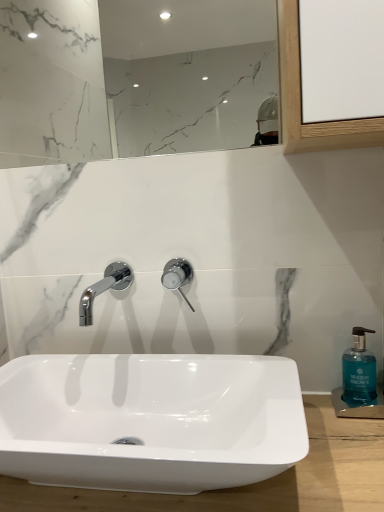
Locate an element on the screen. This screenshot has width=384, height=512. polished chrome tap at center is located at coordinates pos(178,276).

Describe the element at coordinates (255, 483) in the screenshot. I see `white glossy sink at center` at that location.

You are a GUI agent. You are given a task and a screenshot of the screen. Output one action in this format:
    pyautogui.click(x=<x>, y=<y>)
    Task: Click on the white glossy sink at center
    
    Given the screenshot: What is the action you would take?
    pyautogui.click(x=255, y=483)

Locate an element on the screen. The width and height of the screenshot is (384, 512). white marble mirror at upper center is located at coordinates (134, 78).

Which is correct: white marble mirror at upper center is inside polished chrome tap at center, or outside of it?

white marble mirror at upper center is located beyond the bounds of polished chrome tap at center.

Considering the sizes of objects white marble mirror at upper center and polished chrome tap at center in the image provided, who is smaller, white marble mirror at upper center or polished chrome tap at center?

Smaller between the two is polished chrome tap at center.

Is white marble mirror at upper center positioned behind polished chrome tap at center?

No, white marble mirror at upper center is closer to the camera.

Is white glossy sink at center facing away from polished chrome tap at center?

No, white glossy sink at center's orientation is not away from polished chrome tap at center.

Does white glossy sink at center have a lesser width compared to polished chrome tap at center?

Incorrect, the width of white glossy sink at center is not less than that of polished chrome tap at center.

From a real-world perspective, is white glossy sink at center positioned above or below polished chrome tap at center?

In terms of real-world spatial position, white glossy sink at center is below polished chrome tap at center.

Is polished chrome tap at center located within white glossy sink at center?

No, polished chrome tap at center is not a part of white glossy sink at center.

Does white glossy sink at center lie behind teal glass soap dispenser at right?

That is False.

From the picture: Considering the relative positions of white glossy sink at center and teal glass soap dispenser at right in the image provided, is white glossy sink at center to the left of teal glass soap dispenser at right from the viewer's perspective?

Yes.

Between white glossy sink at center and teal glass soap dispenser at right, which one has smaller size?

teal glass soap dispenser at right is smaller.

Is white glossy sink at center not within teal glass soap dispenser at right?

Yes, white glossy sink at center is located beyond the bounds of teal glass soap dispenser at right.

Does white marble mirror at upper center turn towards teal glass soap dispenser at right?

No, white marble mirror at upper center is not oriented towards teal glass soap dispenser at right.

From their relative heights in the image, would you say white marble mirror at upper center is taller or shorter than teal glass soap dispenser at right?

white marble mirror at upper center is taller than teal glass soap dispenser at right.

From the image's perspective, is white marble mirror at upper center below teal glass soap dispenser at right?

No.

From a real-world perspective, relative to teal glass soap dispenser at right, is white marble mirror at upper center vertically above or below?

In terms of real-world spatial position, white marble mirror at upper center is above teal glass soap dispenser at right.

From a real-world perspective, is teal glass soap dispenser at right over polished chrome tap at center?

Incorrect, from a real-world perspective, teal glass soap dispenser at right is lower than polished chrome tap at center.

Consider the image. From the image's perspective, between teal glass soap dispenser at right and polished chrome tap at center, which one is located above?

polished chrome tap at center appears higher in the image.

Locate an element on the screen. This screenshot has height=512, width=384. tap behind the teal glass soap dispenser at right is located at coordinates (178, 276).

Would you say teal glass soap dispenser at right is to the left or to the right of polished chrome tap at center in the picture?

From the image, it's evident that teal glass soap dispenser at right is to the right of polished chrome tap at center.

Does teal glass soap dispenser at right have a larger size compared to white glossy sink at center?

Actually, teal glass soap dispenser at right might be smaller than white glossy sink at center.

Is the surface of teal glass soap dispenser at right in direct contact with white glossy sink at center?

No, teal glass soap dispenser at right is not making contact with white glossy sink at center.

Would you say white glossy sink at center is part of teal glass soap dispenser at right's contents?

No, white glossy sink at center is not inside teal glass soap dispenser at right.

Can you confirm if teal glass soap dispenser at right is shorter than white glossy sink at center?

No, teal glass soap dispenser at right is not shorter than white glossy sink at center.

Is teal glass soap dispenser at right far from white marble mirror at upper center?

Yes, teal glass soap dispenser at right and white marble mirror at upper center are quite far apart.

Which point is more distant from viewer, (x=357, y=404) or (x=156, y=144)?

Point (x=156, y=144)

Image resolution: width=384 pixels, height=512 pixels. Find the location of `soap dispenser located below the white marble mirror at upper center (from the image's perspective)`. soap dispenser located below the white marble mirror at upper center (from the image's perspective) is located at coordinates (359, 371).

You are a GUI agent. You are given a task and a screenshot of the screen. Output one action in this format:
    pyautogui.click(x=<x>, y=<y>)
    Task: Click on the tap located below the white marble mirror at upper center (from the image's perspective)
    This screenshot has width=384, height=512.
    Given the screenshot: What is the action you would take?
    pyautogui.click(x=178, y=276)

Find the location of a particular element. The image size is (384, 512). tap on the right of white glossy sink at center is located at coordinates (178, 276).

Looking at the image, which one is located further to polished chrome tap at center, white marble mirror at upper center or white glossy sink at center?

Based on the image, white marble mirror at upper center appears to be further to polished chrome tap at center.

From the image, which object appears to be nearer to polished chrome tap at center, teal glass soap dispenser at right or white glossy sink at center?

Based on the image, teal glass soap dispenser at right appears to be nearer to polished chrome tap at center.

From the picture: Estimate the real-world distances between objects in this image. Which object is closer to teal glass soap dispenser at right, white marble mirror at upper center or white glossy sink at center?

white glossy sink at center is closer to teal glass soap dispenser at right.

Estimate the real-world distances between objects in this image. Which object is further from white marble mirror at upper center, white glossy sink at center or teal glass soap dispenser at right?

white glossy sink at center is further to white marble mirror at upper center.

Looking at this image, which object lies nearer to the anchor point teal glass soap dispenser at right, white marble mirror at upper center or polished chrome tap at center?

polished chrome tap at center.

When comparing their distances from white glossy sink at center, does teal glass soap dispenser at right or polished chrome tap at center seem closer?

The object closer to white glossy sink at center is teal glass soap dispenser at right.

Estimate the real-world distances between objects in this image. Which object is further from white glossy sink at center, teal glass soap dispenser at right or white marble mirror at upper center?

white marble mirror at upper center is further to white glossy sink at center.

From the image, which object appears to be nearer to teal glass soap dispenser at right, polished chrome tap at center or white marble mirror at upper center?

polished chrome tap at center lies closer to teal glass soap dispenser at right than the other object.

Where is `tap between white marble mirror at upper center and teal glass soap dispenser at right in the up-down direction`? The height and width of the screenshot is (512, 384). tap between white marble mirror at upper center and teal glass soap dispenser at right in the up-down direction is located at coordinates (178, 276).

The height and width of the screenshot is (512, 384). Find the location of `tap between white marble mirror at upper center and white glossy sink at center vertically`. tap between white marble mirror at upper center and white glossy sink at center vertically is located at coordinates click(x=178, y=276).

The height and width of the screenshot is (512, 384). I want to click on tap between white glossy sink at center and teal glass soap dispenser at right from left to right, so click(178, 276).

Image resolution: width=384 pixels, height=512 pixels. I want to click on soap dispenser that lies between white marble mirror at upper center and white glossy sink at center from top to bottom, so click(359, 371).